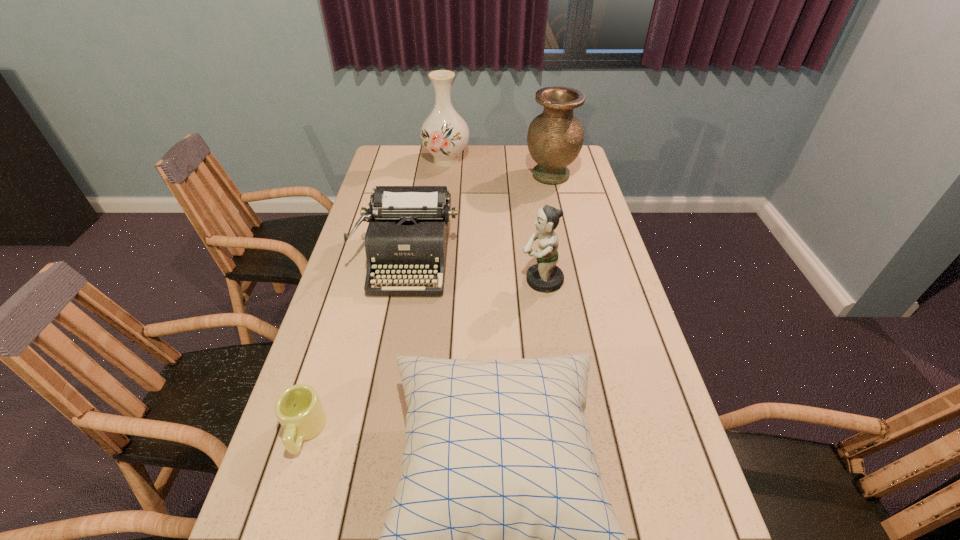
This screenshot has width=960, height=540. Identify the location of free spot located on the front-facing side of the typewriter. (382, 403).

I want to click on free point located with the handle on the side of the mug, so click(x=283, y=499).

Find the location of `typewriter positioned at the left edge`. typewriter positioned at the left edge is located at coordinates (407, 235).

Where is `mug that is positioned at the left edge`? mug that is positioned at the left edge is located at coordinates (298, 408).

Where is `object at the right edge`? The width and height of the screenshot is (960, 540). object at the right edge is located at coordinates (555, 137).

Identify the location of object present at the far right corner. The image size is (960, 540). [555, 137].

In the image, there is a desktop. Where is `vacant region at the far edge`? This screenshot has height=540, width=960. vacant region at the far edge is located at coordinates (489, 147).

In the image, there is a desktop. Identify the location of free space at the left edge. Image resolution: width=960 pixels, height=540 pixels. (364, 238).

The height and width of the screenshot is (540, 960). In the image, there is a desktop. What are the coordinates of `vacant region at the right edge` in the screenshot? It's located at (585, 176).

What are the coordinates of `free space between the right vase and the typewriter` in the screenshot? It's located at (479, 218).